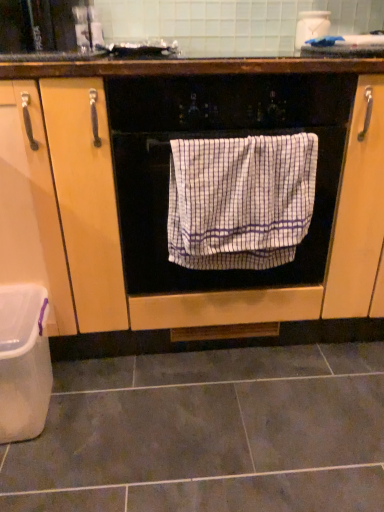
At what (x,y) coordinates should I click in order to perform the action: click on vacant region to the right of white plastic container at lower left. Please return your answer as a coordinate pair (x, y). This screenshot has height=512, width=384. Looking at the image, I should click on (111, 409).